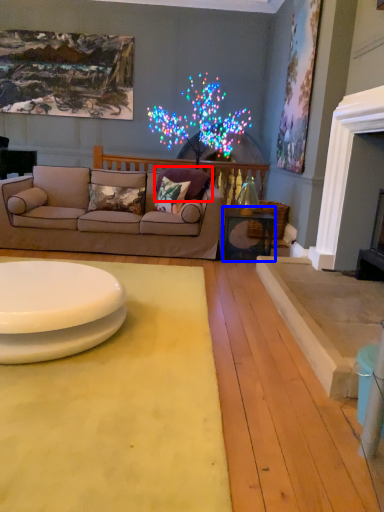
Question: Which object appears farthest to the camera in this image, pillow (highlighted by a red box) or table (highlighted by a blue box)?

Choices:
 (A) pillow
 (B) table

Answer: (A)